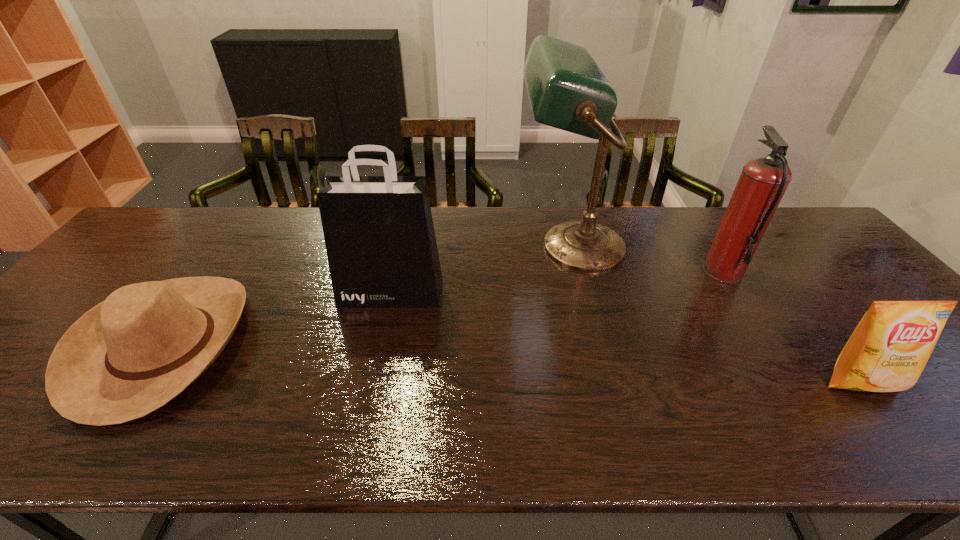
Locate an element on the screen. the tallest object is located at coordinates click(x=567, y=90).

Locate an element on the screen. This screenshot has width=960, height=540. the third object from right to left is located at coordinates (567, 90).

Identify the location of the fourth object from right to left. Image resolution: width=960 pixels, height=540 pixels. (379, 235).

Where is `the second object from right to left`? The image size is (960, 540). the second object from right to left is located at coordinates (763, 181).

This screenshot has height=540, width=960. I want to click on the rightmost object, so (887, 352).

Find the location of a particular element. the fourth tallest object is located at coordinates (887, 352).

This screenshot has width=960, height=540. I want to click on the leftmost object, so click(x=132, y=353).

Locate an element on the screen. cowboy hat is located at coordinates (132, 353).

Find the location of a particular element. blank area located 0.360m above the green lampshade of the table lamp is located at coordinates (399, 247).

Locate an element on the screen. vacant area situated above the green lampshade of the table lamp is located at coordinates (396, 247).